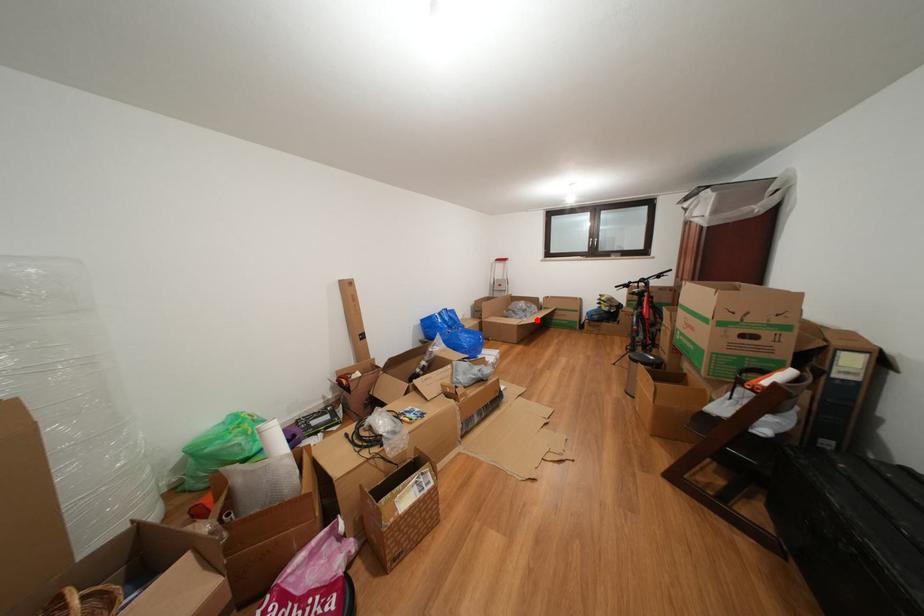
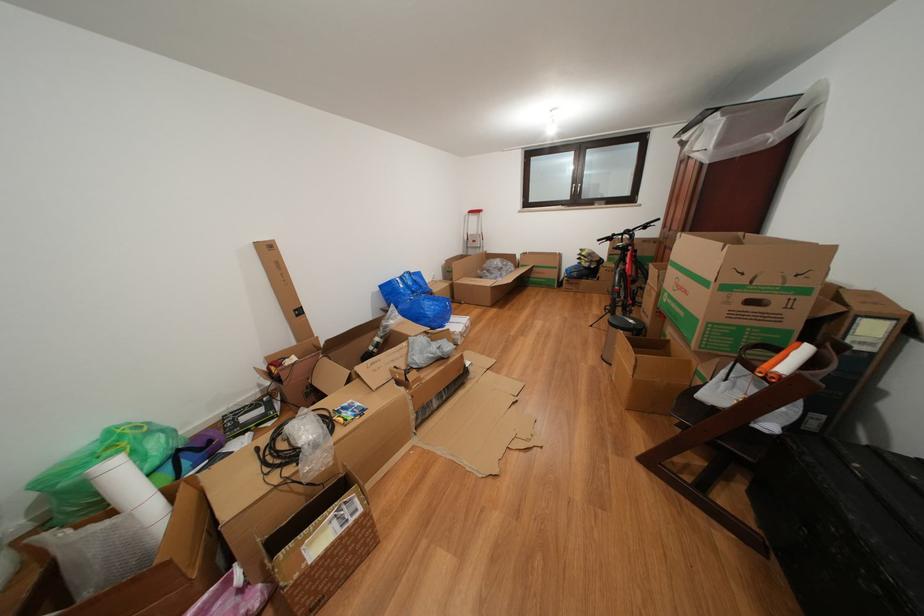
Locate, in the second image, the point that corresponds to the highlighted location in the first image.

(513, 280)